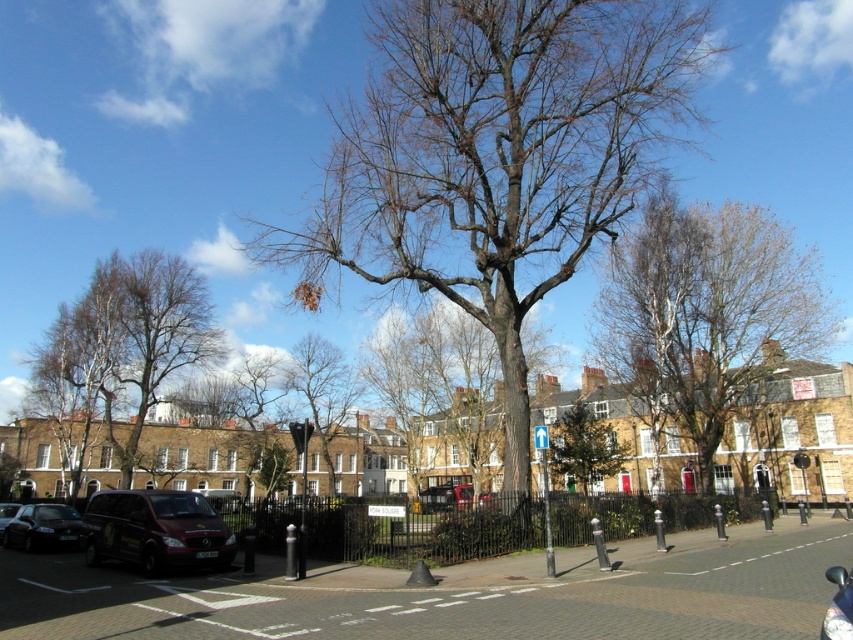
Question: Can you confirm if brown textured tree at upper right is positioned below metallic purple van at lower left?

Choices:
 (A) no
 (B) yes

Answer: (A)

Question: Is green leafy tree at center below metallic silver van at center?

Choices:
 (A) no
 (B) yes

Answer: (A)

Question: Which point is farther to the camera?

Choices:
 (A) metallic purple van at lower left
 (B) metallic silver van at center
 (C) shiny black van at lower right

Answer: (B)

Question: Which of the following is the closest to the observer?

Choices:
 (A) shiny black van at lower right
 (B) white bark tree at left
 (C) metallic silver van at center
 (D) green leafy tree at center

Answer: (A)

Question: Does brown textured tree at upper right have a larger size compared to shiny black van at lower right?

Choices:
 (A) yes
 (B) no

Answer: (A)

Question: Which point is closer to the camera?

Choices:
 (A) (289, 240)
 (B) (322, 440)
 (C) (61, 502)
 (D) (137, 493)

Answer: (D)